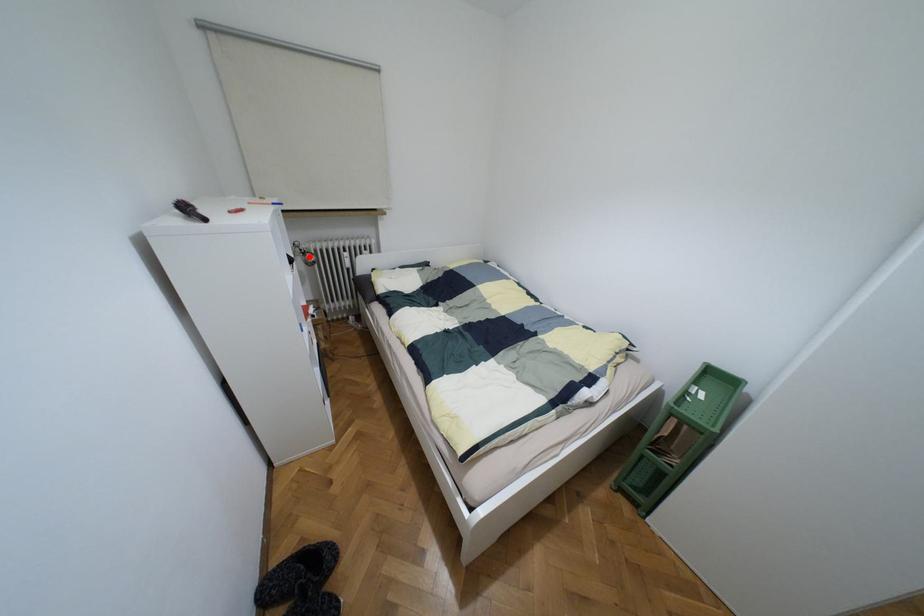
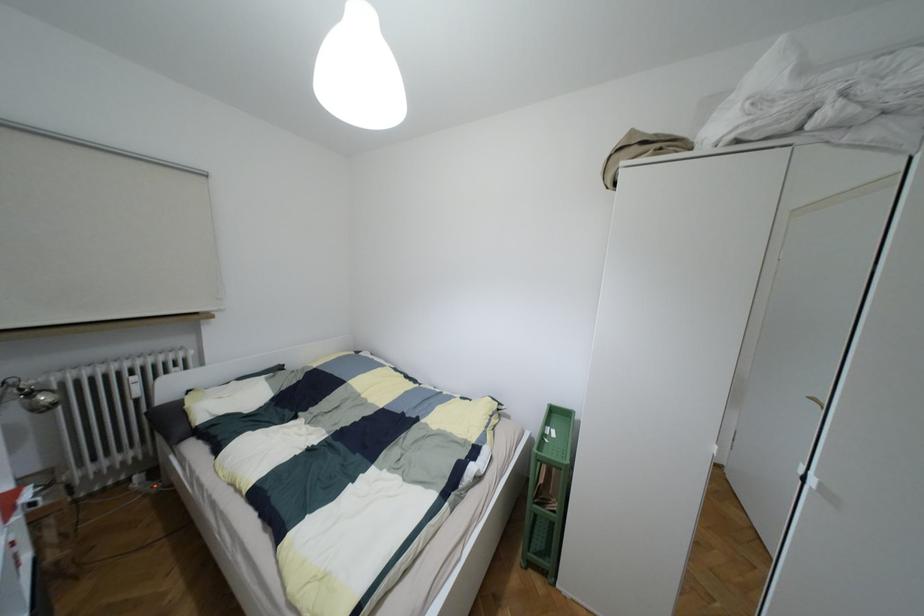
The point at the highlighted location is marked in the first image. Where is the corresponding point in the second image?

(43, 397)